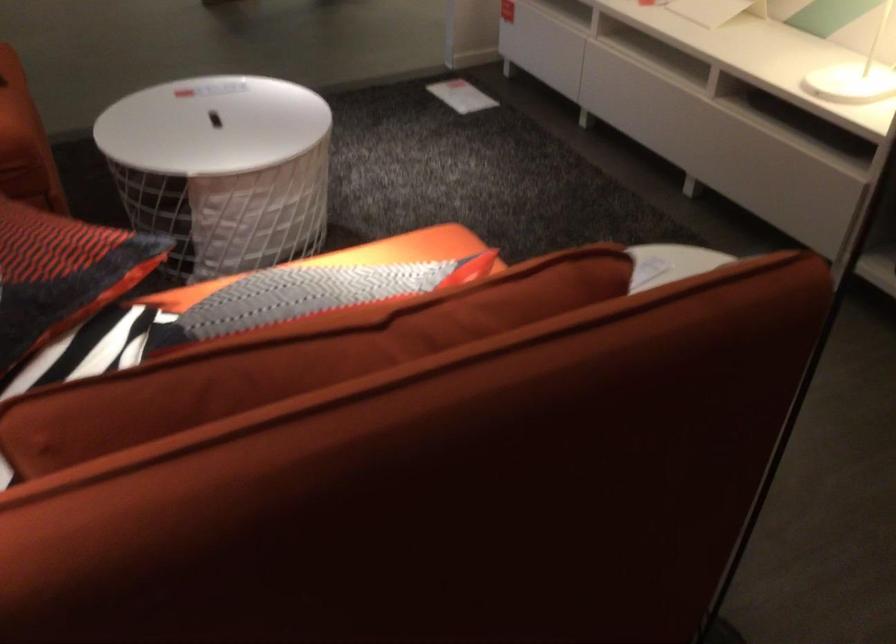
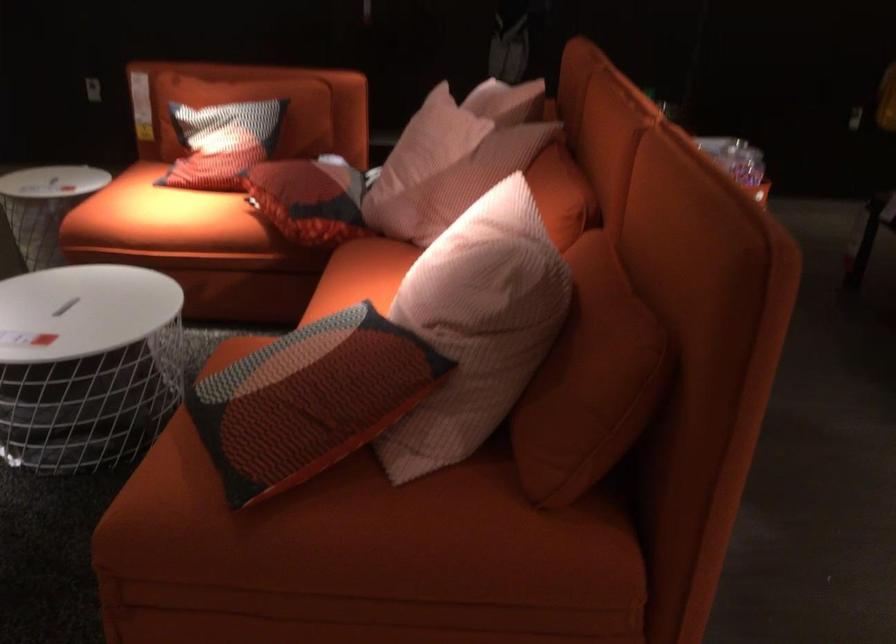
Find the pixel in the second image that matches the point at 279,274 in the first image.

(222, 142)